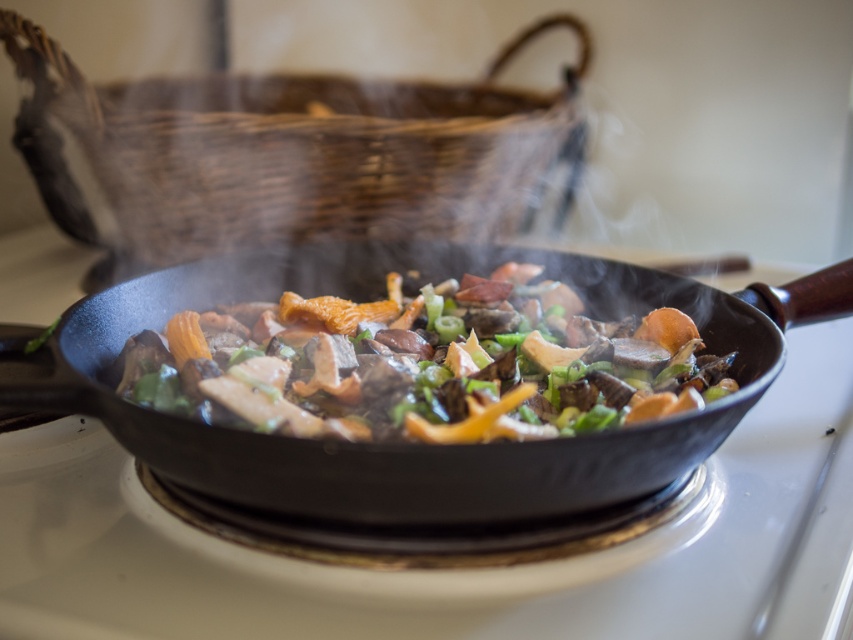
You are a chef preparing ingredients and need to place the shiny black pan at center on top of the woven brown basket at upper center. Can you do this without the pan falling off?

The woven brown basket at upper center is much taller than the shiny black pan at center, so placing the pan on top of the basket might be unstable because the pan is shorter in height compared to the basket. The pan could potentially tip over or not sit securely due to the height difference.

You are a chef preparing ingredients. You have a woven brown basket at upper center and a shiny brown pan at center. Which container can hold more vegetables based on their sizes?

The woven brown basket at upper center has a larger size compared to the shiny brown pan at center, so it can hold more vegetables.

You are a chef holding a 12 inch spatula and need to reach the woven brown basket at upper center. Can you comfortably reach it without moving your feet?

The woven brown basket at upper center is 34.54 inches away from the camera. Since the spatula is only 12 inches long, you cannot comfortably reach it without moving your feet.